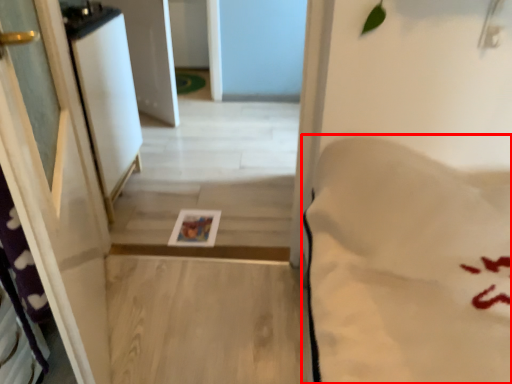
Question: From the image's perspective, what is the correct spatial relationship of sheet (annotated by the red box) in relation to screen door?

Choices:
 (A) below
 (B) above

Answer: (A)